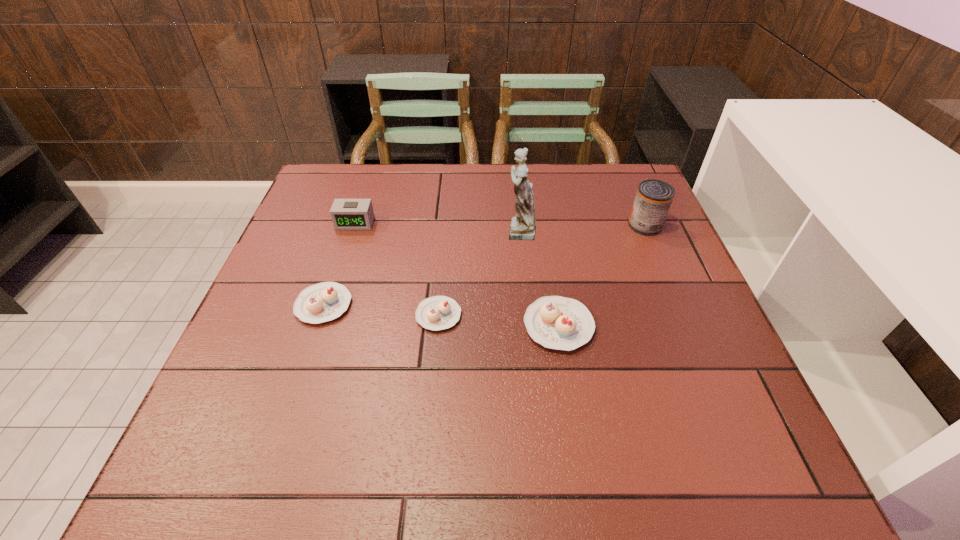
Please point a spot to add another cupcake on the right. Please provide its 2D coordinates. Your answer should be formatted as a tuple, i.e. [(x, y)], where the tuple contains the x and y coordinates of a point satisfying the conditions above.

[(684, 336)]